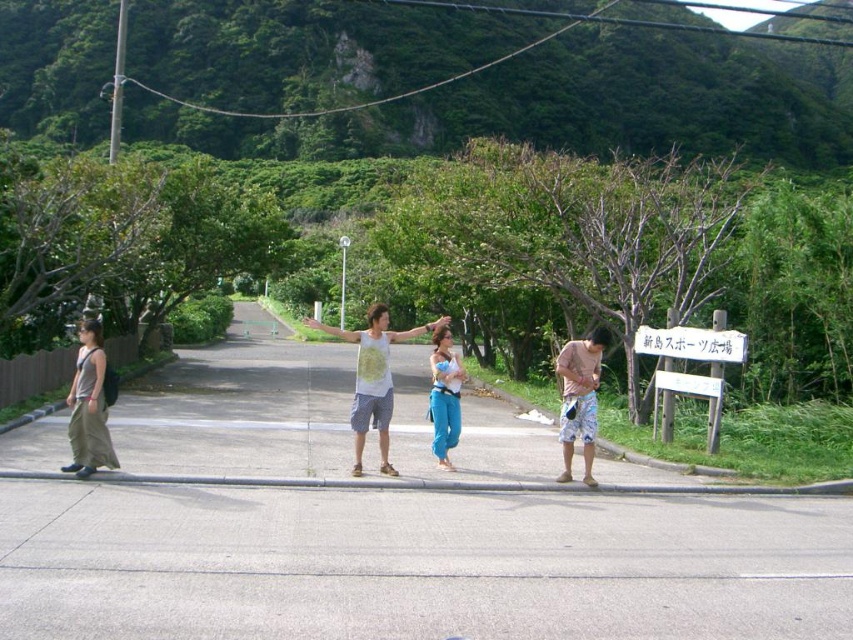
You are standing at point (564, 403) and want to reach the signpost with Japanese text on the right side of the road. The distance between you and the signpost is 10.37 meters. If you walk straight towards it, will you cross the curb into the road?

Yes, because the signpost is on the right side of the road, and you are at point (564, 403) which is likely on the sidewalk. Walking straight towards the signpost would require crossing the curb into the road since the sign is positioned along the road edge.

You are a photographer trying to capture a clear shot of the matte gray tank top at left and the white wooden sign at center. Since you want both subjects to be equally prominent in the photo, which object should you zoom in on more?

The matte gray tank top at left is smaller than the white wooden sign at center, so you should zoom in more on the matte gray tank top at left to make it appear larger in the photo and balance its prominence with the white wooden sign at center.